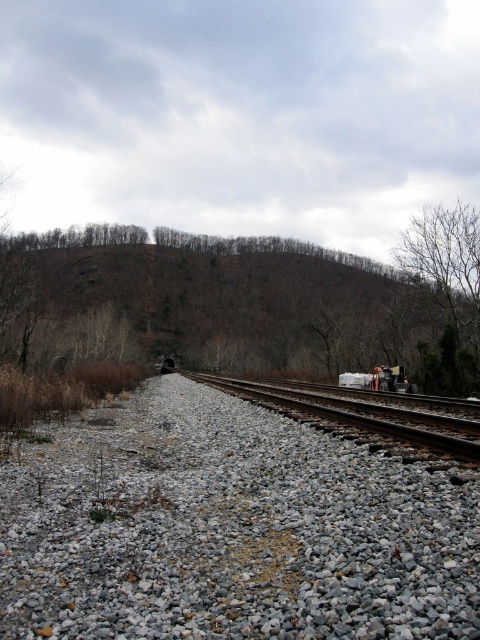
Is point (147, 596) positioned in front of point (354, 372)?

Yes.

Is gray gravel at center thinner than white matte train at center-right?

No, gray gravel at center is not thinner than white matte train at center-right.

Locate an element on the screen. gray gravel at center is located at coordinates click(x=231, y=529).

Is bare rock hillside at center smaller than white matte train at center-right?

Actually, bare rock hillside at center might be larger than white matte train at center-right.

Is point (478, 314) farther from viewer compared to point (406, 385)?

Yes, it is behind point (406, 385).

The image size is (480, 640). Find the location of `bare rock hillside at center`. bare rock hillside at center is located at coordinates (229, 310).

Does gray gravel at center appear on the right side of smooth metal train track at center?

No, gray gravel at center is not to the right of smooth metal train track at center.

Can you confirm if gray gravel at center is positioned to the left of smooth metal train track at center?

Indeed, gray gravel at center is positioned on the left side of smooth metal train track at center.

Locate an element on the screen. gray gravel at center is located at coordinates (231, 529).